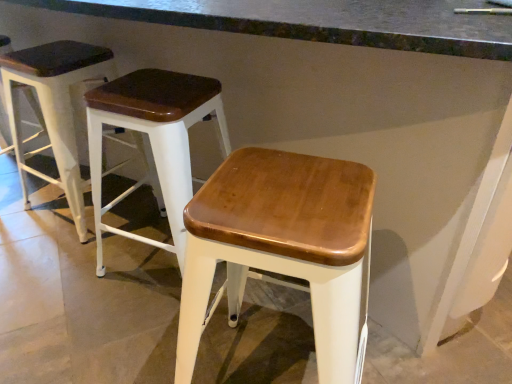
Identify the location of free space above wooden seat at center, the 2th stool from the left (from a real-world perspective). (141, 92).